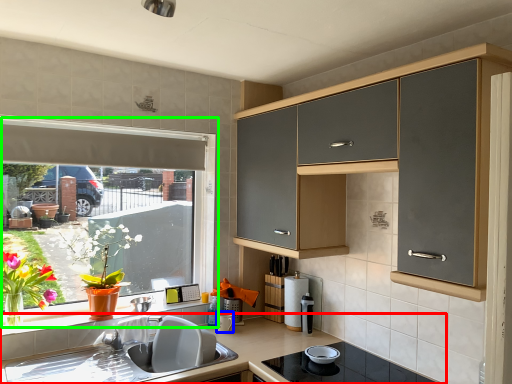
Question: Which object is positioned farthest from countertop (highlighted by a red box)? Select from appliance (highlighted by a blue box) and window (highlighted by a green box).

Choices:
 (A) appliance
 (B) window

Answer: (B)